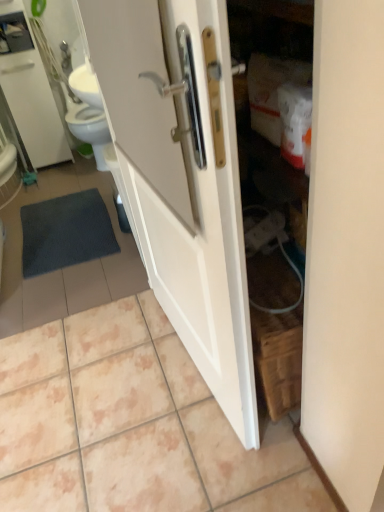
Question: From the image's perspective, does white glossy door at center appear lower than white glossy tile at center?

Choices:
 (A) no
 (B) yes

Answer: (A)

Question: Considering the relative sizes of white glossy door at center and white glossy tile at center in the image provided, is white glossy door at center bigger than white glossy tile at center?

Choices:
 (A) no
 (B) yes

Answer: (A)

Question: Is white glossy door at center at the right side of white glossy tile at center?

Choices:
 (A) yes
 (B) no

Answer: (A)

Question: Does white glossy door at center have a greater width compared to white glossy tile at center?

Choices:
 (A) no
 (B) yes

Answer: (A)

Question: From a real-world perspective, is white glossy door at center under white glossy tile at center?

Choices:
 (A) yes
 (B) no

Answer: (B)

Question: From the image's perspective, does white glossy door at center appear higher than white glossy tile at center?

Choices:
 (A) yes
 (B) no

Answer: (A)

Question: Would you say white glossy medicine cabinet at upper left contains dark gray textured bath mat at lower left?

Choices:
 (A) no
 (B) yes

Answer: (A)

Question: Is white glossy medicine cabinet at upper left completely or partially outside of dark gray textured bath mat at lower left?

Choices:
 (A) yes
 (B) no

Answer: (A)

Question: Can you confirm if white glossy medicine cabinet at upper left is positioned to the right of dark gray textured bath mat at lower left?

Choices:
 (A) no
 (B) yes

Answer: (A)

Question: Does white glossy medicine cabinet at upper left lie behind dark gray textured bath mat at lower left?

Choices:
 (A) yes
 (B) no

Answer: (A)

Question: Is white glossy medicine cabinet at upper left taller than dark gray textured bath mat at lower left?

Choices:
 (A) yes
 (B) no

Answer: (A)

Question: From a real-world perspective, is white glossy medicine cabinet at upper left located higher than dark gray textured bath mat at lower left?

Choices:
 (A) yes
 (B) no

Answer: (A)

Question: Are white glossy tile at center and white glossy medicine cabinet at upper left making contact?

Choices:
 (A) no
 (B) yes

Answer: (A)